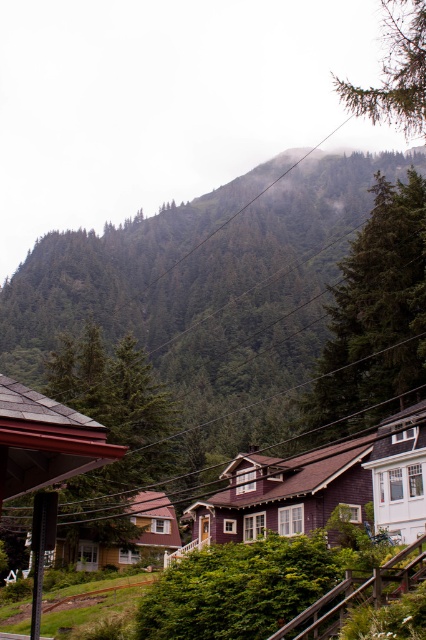
Question: Does green textured tree at center appear under white wood house at right?

Choices:
 (A) yes
 (B) no

Answer: (B)

Question: Which point is farther from the camera taking this photo?

Choices:
 (A) (40, 396)
 (B) (416, 186)

Answer: (B)

Question: Is purple wood house at center to the right of brown wooden train track at lower center from the viewer's perspective?

Choices:
 (A) yes
 (B) no

Answer: (A)

Question: Does purple wood house at center appear under wooden cabin at center?

Choices:
 (A) yes
 (B) no

Answer: (B)

Question: Which point is closer to the camera?

Choices:
 (A) (62, 278)
 (B) (408, 52)

Answer: (B)

Question: Which object appears farthest from the camera in this image?

Choices:
 (A) green textured tree at center
 (B) brown wooden train track at lower center
 (C) white wood house at right
 (D) wooden cabin at center

Answer: (A)